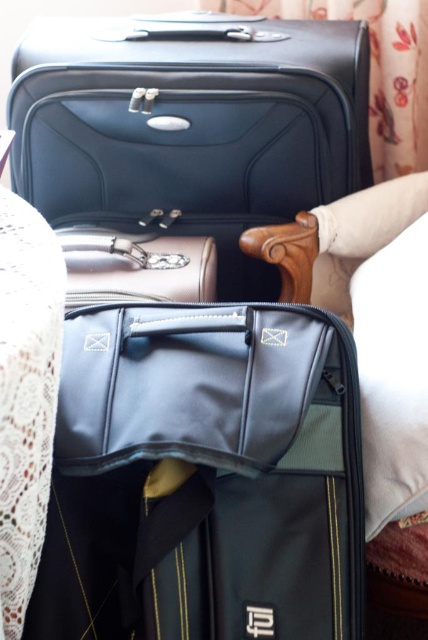
Question: Does matte black suitcase at upper center have a lesser width compared to black fabric bed at center?

Choices:
 (A) yes
 (B) no

Answer: (B)

Question: Can you confirm if matte black suitcase at upper center is positioned to the right of white soft pillow at right?

Choices:
 (A) no
 (B) yes

Answer: (A)

Question: Does black fabric bed at center have a greater width compared to leather-like brown suitcase at center?

Choices:
 (A) no
 (B) yes

Answer: (B)

Question: Estimate the real-world distances between objects in this image. Which object is closer to the leather-like brown suitcase at center?

Choices:
 (A) black fabric bed at center
 (B) matte black bag at center
 (C) white soft pillow at right

Answer: (B)

Question: Considering the real-world distances, which object is closest to the white soft pillow at right?

Choices:
 (A) black fabric bed at center
 (B) matte black bag at center

Answer: (A)

Question: Which point is farther to the camera?

Choices:
 (A) (116, 240)
 (B) (166, 330)
 (C) (342, 296)

Answer: (C)